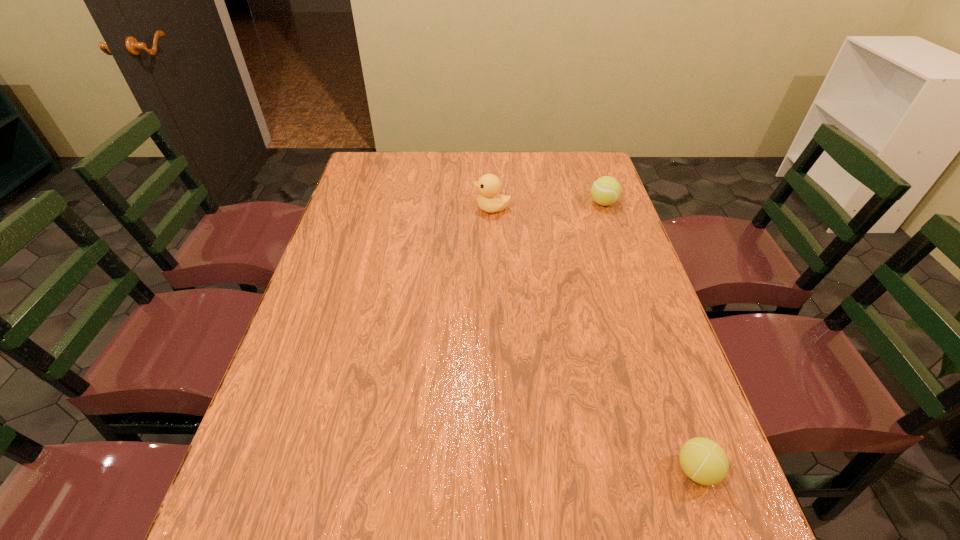
Locate an element on the screen. This screenshot has height=540, width=960. vacant area in the image that satisfies the following two spatial constraints: 1. on the back side of the shortest object; 2. on the face of the tallest object is located at coordinates (605, 208).

This screenshot has height=540, width=960. I want to click on free space that satisfies the following two spatial constraints: 1. on the front side of the second tallest object; 2. on the right side of the nearer tennis ball, so click(x=696, y=470).

Identify the location of vacant space that satisfies the following two spatial constraints: 1. on the back side of the shortest object; 2. on the face of the leftmost object. This screenshot has height=540, width=960. (605, 208).

This screenshot has width=960, height=540. I want to click on blank space that satisfies the following two spatial constraints: 1. on the face of the tallest object; 2. on the left side of the nearer tennis ball, so click(500, 470).